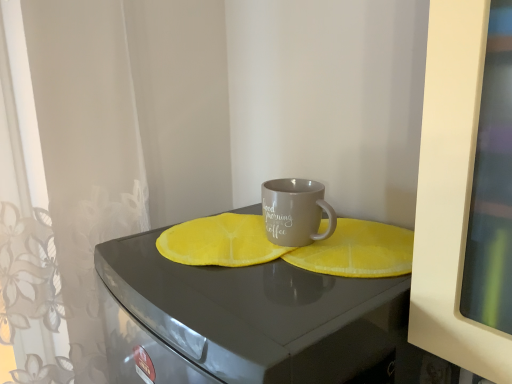
This screenshot has width=512, height=384. Identify the location of free space in front of matte gray mug at center. (305, 291).